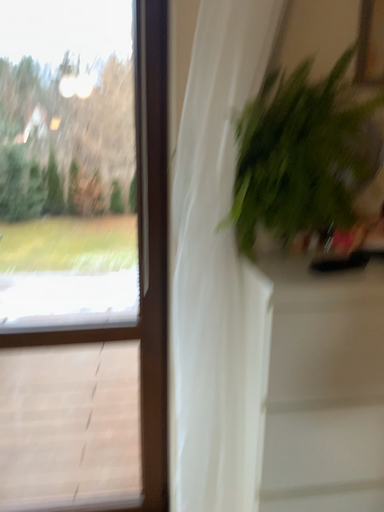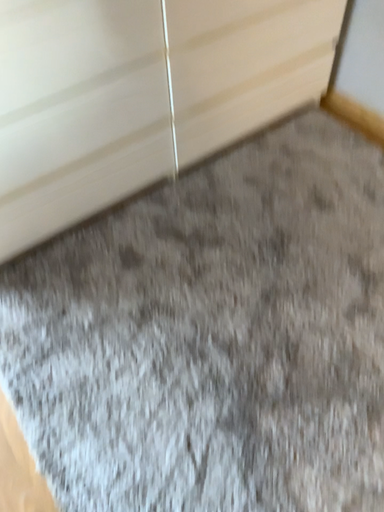
Question: How did the camera likely rotate when shooting the video?

Choices:
 (A) rotated downward
 (B) rotated upward

Answer: (A)